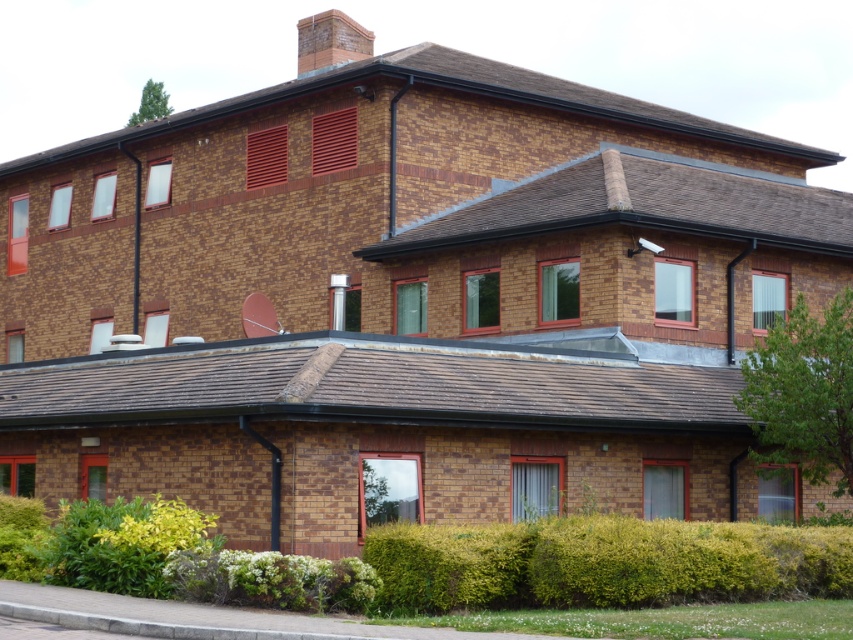
Question: Does green leafy hedge at lower center appear on the left side of green leafy hedge at lower left?

Choices:
 (A) no
 (B) yes

Answer: (A)

Question: Which object is positioned closest to the green leafy bush at upper right?

Choices:
 (A) green leafy hedge at lower center
 (B) green leafy hedge at lower left

Answer: (A)

Question: Based on their relative distances, which object is farther from the green leafy hedge at lower left?

Choices:
 (A) green leafy hedge at lower center
 (B) green leafy bush at upper right

Answer: (B)

Question: Can you confirm if green leafy bush at upper right is wider than green leafy hedge at lower left?

Choices:
 (A) yes
 (B) no

Answer: (B)

Question: Where is green leafy hedge at lower center located in relation to green leafy hedge at lower left in the image?

Choices:
 (A) left
 (B) right

Answer: (B)

Question: Which is farther from the green leafy hedge at lower center?

Choices:
 (A) green leafy bush at upper right
 (B) green leafy hedge at lower left

Answer: (A)